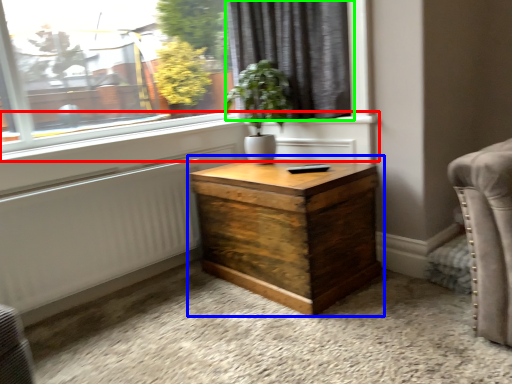
Question: Which object is the closest to the window sill (highlighted by a red box)? Choose among these: nightstand (highlighted by a blue box) or curtain (highlighted by a green box).

Choices:
 (A) nightstand
 (B) curtain

Answer: (B)